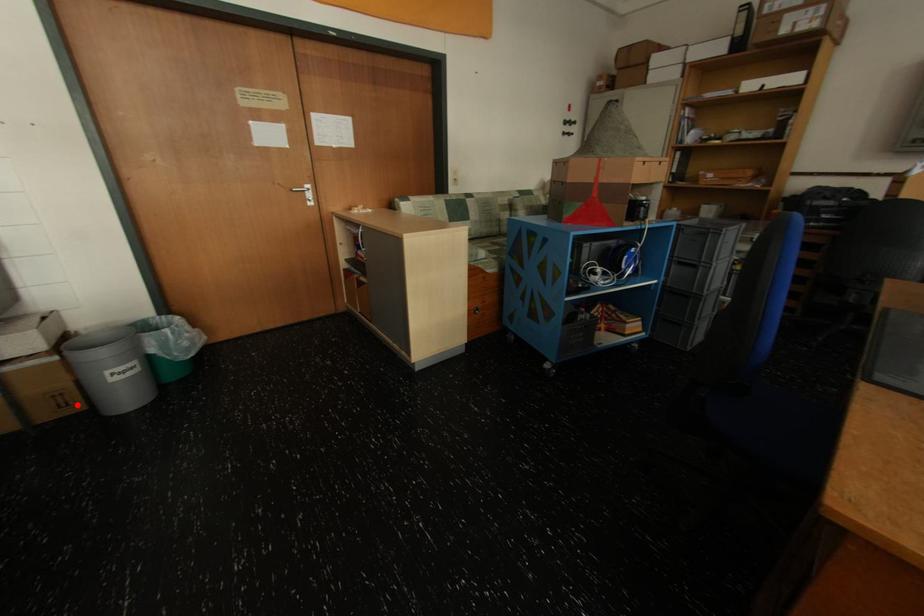
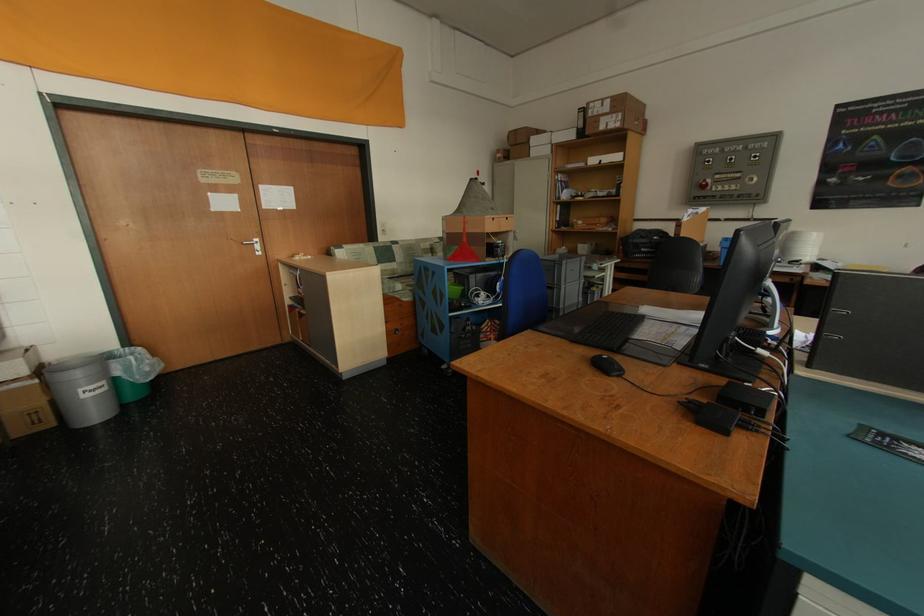
Question: I am providing you with two images of the same scene from different viewpoints. Image1 has a red point marked. In image2, the corresponding 3D location appears at what relative position? Reply with the corresponding letter.

Choices:
 (A) Closer
 (B) Farther

Answer: (B)